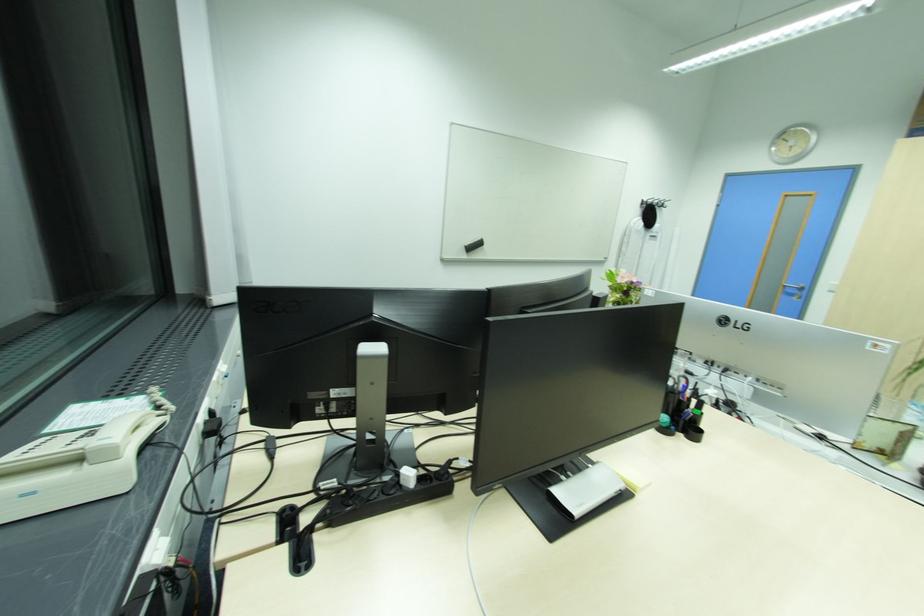
What do you see at coordinates (74, 467) in the screenshot?
I see `a white phone handset` at bounding box center [74, 467].